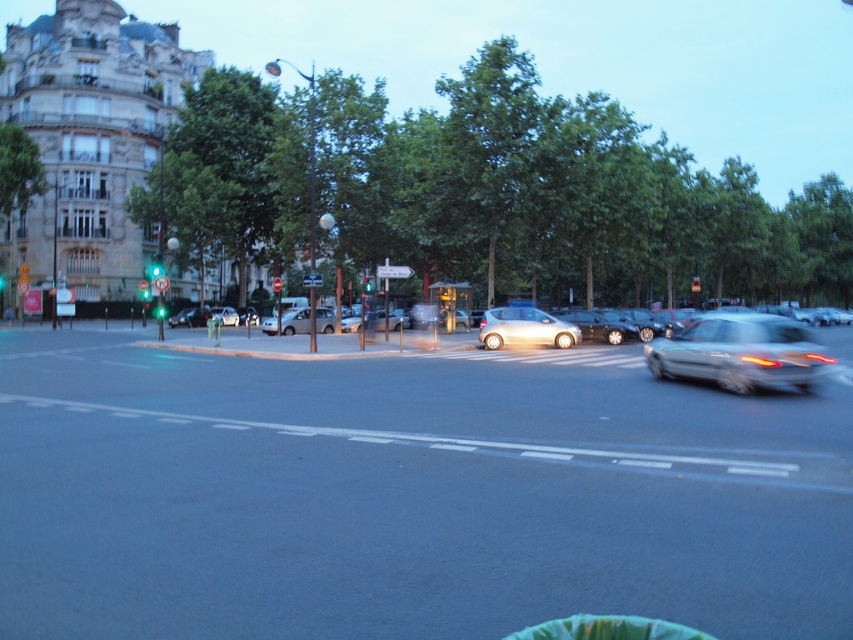
What do you see at coordinates (154, 269) in the screenshot? I see `green glass traffic light at upper center` at bounding box center [154, 269].

Is green glass traffic light at upper center positioned at the back of green glass traffic light at center?

Yes, it is behind green glass traffic light at center.

Between point (151, 266) and point (367, 282), which one is positioned behind?

Point (151, 266)

The image size is (853, 640). I want to click on green glass traffic light at upper center, so click(154, 269).

The height and width of the screenshot is (640, 853). I want to click on green leafy tree at upper center, so click(561, 196).

Which is more to the right, green leafy tree at upper center or green glass traffic light at upper center?

Positioned to the right is green leafy tree at upper center.

Is point (611, 170) closer to camera compared to point (157, 276)?

That is False.

What are the coordinates of `green leafy tree at upper center` in the screenshot? It's located at (561, 196).

Who is taller, silver metallic car at right or green glass traffic light at upper center?

green glass traffic light at upper center is taller.

Does silver metallic car at right have a lesser width compared to green glass traffic light at upper center?

Indeed, silver metallic car at right has a lesser width compared to green glass traffic light at upper center.

Is point (701, 332) positioned before point (154, 275)?

Yes, it is in front of point (154, 275).

Locate an element on the screen. This screenshot has width=853, height=640. silver metallic car at right is located at coordinates (741, 353).